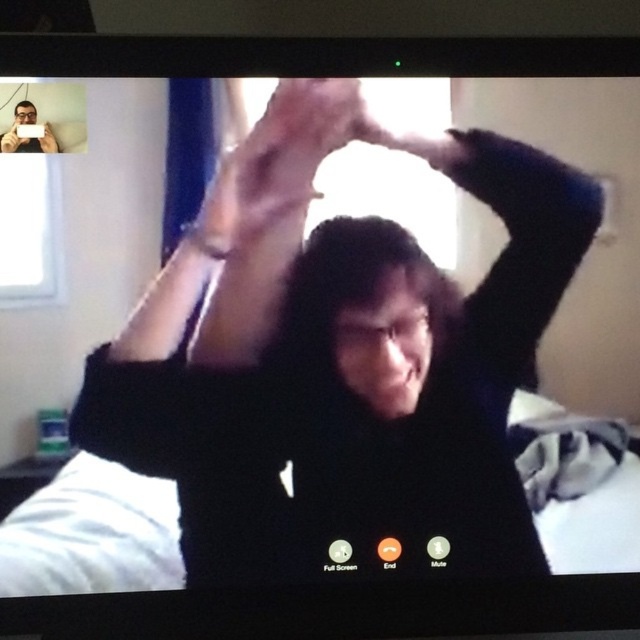
You are setting up a video call and want to ensure both the black matte shirt at center and the matte black phone at upper left are visible. Which object will appear larger in the frame?

The black matte shirt at center appears larger in the frame because it has a greater height compared to the matte black phone at upper left.

You are a photographer trying to capture a closeup of the person forming a heart with their hands in the main video call window. Given that the matte black hair at center is wider than the matte black hair at upper center, which of the two should you focus on to ensure the subject is framed properly?

The matte black hair at center is wider than the matte black hair at upper center, so focusing on the matte black hair at center will ensure the subject is framed properly.

You are trying to determine if the distance between the black matte shirt at center and the matte black phone at upper left is less than 20 inches. Based on the scene, can you confirm this?

The black matte shirt at center is 18.93 inches from the matte black phone at upper left, so yes, the distance is less than 20 inches.